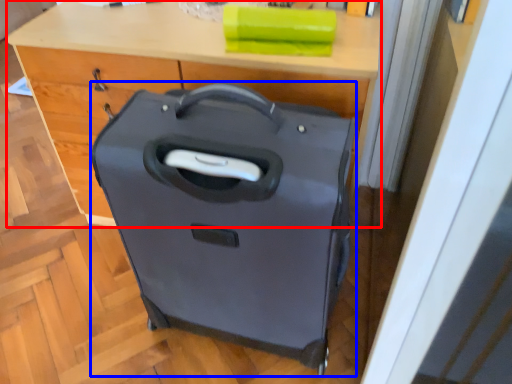
Question: Which point is closer to the camera, computer desk (highlighted by a red box) or suitcase (highlighted by a blue box)?

Choices:
 (A) computer desk
 (B) suitcase

Answer: (B)